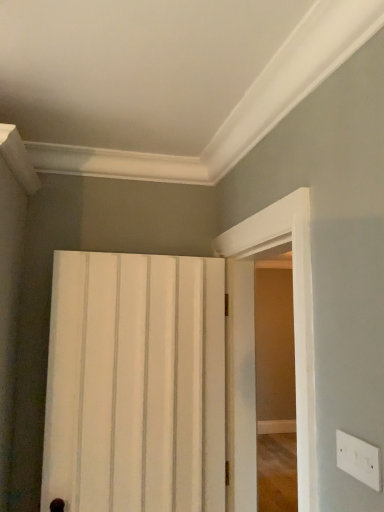
The height and width of the screenshot is (512, 384). What do you see at coordinates (136, 384) in the screenshot?
I see `white matte door at center` at bounding box center [136, 384].

In order to face white matte door at center, should I rotate leftwards or rightwards?

Turn left by 6.582 degrees to look at white matte door at center.

Measure the distance between point (365, 470) and camera.

Point (365, 470) is 34.88 inches away from camera.

This screenshot has height=512, width=384. Find the location of `white matte door at center`. white matte door at center is located at coordinates (136, 384).

Where is `screen door behind the white plastic electric outlet at lower right`? This screenshot has height=512, width=384. screen door behind the white plastic electric outlet at lower right is located at coordinates (254, 345).

Based on the photo, considering the sizes of white glossy door at right and white plastic electric outlet at lower right in the image, is white glossy door at right wider or thinner than white plastic electric outlet at lower right?

white glossy door at right is wider than white plastic electric outlet at lower right.

Is white glossy door at right to the right of white plastic electric outlet at lower right from the viewer's perspective?

In fact, white glossy door at right is to the left of white plastic electric outlet at lower right.

Is white glossy door at right positioned far away from white plastic electric outlet at lower right?

white glossy door at right is near white plastic electric outlet at lower right, not far away.

Image resolution: width=384 pixels, height=512 pixels. I want to click on screen door on the right of white matte door at center, so click(x=254, y=345).

Is white matte door at center wider or thinner than white glossy door at right?

Clearly, white matte door at center has less width compared to white glossy door at right.

Is white matte door at center surrounding white glossy door at right?

That's incorrect, white glossy door at right is not inside white matte door at center.

How different are the orientations of white plastic electric outlet at lower right and white glossy door at right in degrees?

The facing directions of white plastic electric outlet at lower right and white glossy door at right are 2.58 degrees apart.

Is white plastic electric outlet at lower right taller or shorter than white glossy door at right?

Considering their sizes, white plastic electric outlet at lower right has less height than white glossy door at right.

Considering the positions of point (343, 457) and point (234, 242), is point (343, 457) closer or farther from the camera than point (234, 242)?

Point (343, 457) is closer to the camera than point (234, 242).

From a real-world perspective, which is physically below, white plastic electric outlet at lower right or white glossy door at right?

white plastic electric outlet at lower right.

Is white matte door at center inside or outside of white plastic electric outlet at lower right?

white matte door at center exists outside the volume of white plastic electric outlet at lower right.

Does white matte door at center have a smaller size compared to white plastic electric outlet at lower right?

Actually, white matte door at center might be larger than white plastic electric outlet at lower right.

From a real-world perspective, which object rests below the other?

white matte door at center, from a real-world perspective.

Considering the positions of objects white matte door at center and white plastic electric outlet at lower right in the image provided, who is more to the left, white matte door at center or white plastic electric outlet at lower right?

white matte door at center.

From the picture: Does white plastic electric outlet at lower right have a larger size compared to white matte door at center?

Actually, white plastic electric outlet at lower right might be smaller than white matte door at center.

Can we say white plastic electric outlet at lower right lies outside white matte door at center?

Absolutely, white plastic electric outlet at lower right is external to white matte door at center.

Between point (358, 440) and point (76, 388), which one is positioned behind?

The point (76, 388) is behind.

Considering the sizes of objects white glossy door at right and white matte door at center in the image provided, who is bigger, white glossy door at right or white matte door at center?

white glossy door at right.

Based on their positions, is white glossy door at right located to the left or right of white matte door at center?

From the image, it's evident that white glossy door at right is to the right of white matte door at center.

Where is `door behind the white glossy door at right`? This screenshot has height=512, width=384. door behind the white glossy door at right is located at coordinates (136, 384).

This screenshot has height=512, width=384. I want to click on electric outlet that is above the white glossy door at right (from the image's perspective), so click(x=359, y=459).

I want to click on door lying behind the white glossy door at right, so click(136, 384).

From the image, which object appears to be nearer to white matte door at center, white glossy door at right or white plastic electric outlet at lower right?

white glossy door at right is closer to white matte door at center.

When comparing their distances from white glossy door at right, does white matte door at center or white plastic electric outlet at lower right seem further?

Based on the image, white plastic electric outlet at lower right appears to be further to white glossy door at right.

Which object lies nearer to the anchor point white glossy door at right, white plastic electric outlet at lower right or white matte door at center?

white matte door at center is positioned closer to the anchor white glossy door at right.

Looking at the image, which one is located further to white plastic electric outlet at lower right, white glossy door at right or white matte door at center?

white matte door at center is further to white plastic electric outlet at lower right.

Looking at this image, looking at the image, which one is located further to white matte door at center, white plastic electric outlet at lower right or white glossy door at right?

white plastic electric outlet at lower right is further to white matte door at center.

Based on their spatial positions, is white matte door at center or white glossy door at right further from white plastic electric outlet at lower right?

Based on the image, white matte door at center appears to be further to white plastic electric outlet at lower right.

The height and width of the screenshot is (512, 384). I want to click on screen door between white plastic electric outlet at lower right and white matte door at center in the front-back direction, so click(x=254, y=345).